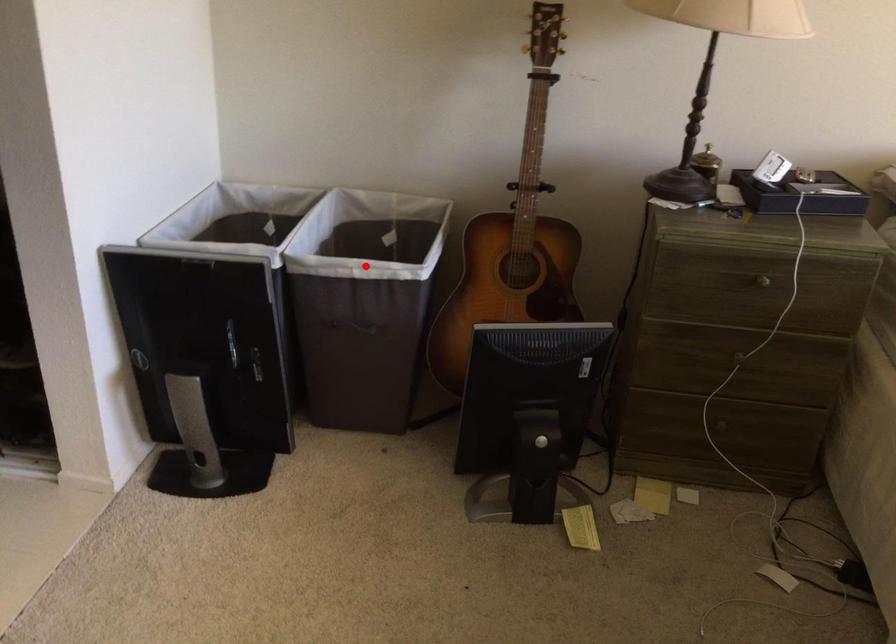
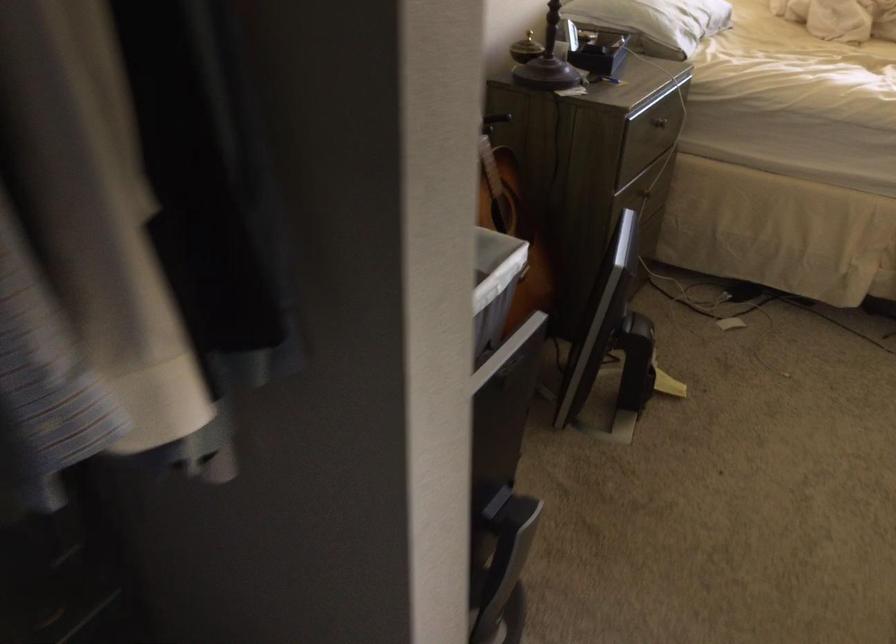
Find the pixel in the second image that matches the highlighted location in the first image.

(494, 286)